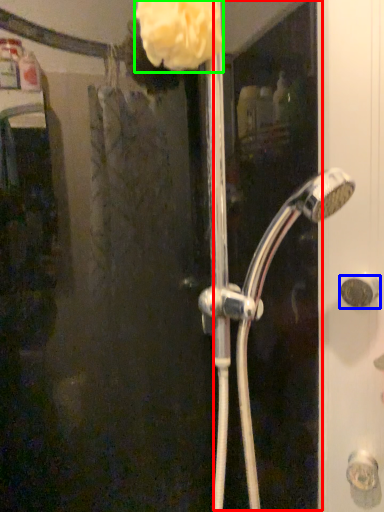
Question: Based on their relative distances, which object is farther from screen door (highlighted by a red box)? Choose from door handle (highlighted by a blue box) and flower (highlighted by a green box).

Choices:
 (A) door handle
 (B) flower

Answer: (B)